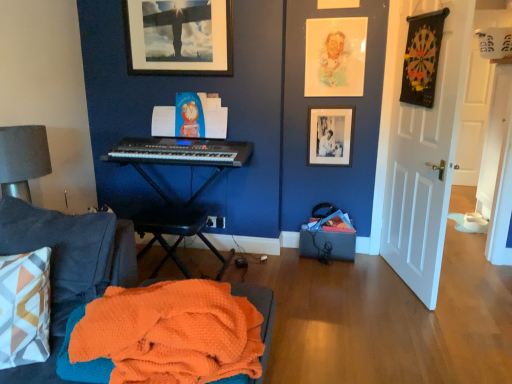
Locate an element on the screen. Image resolution: width=512 pixels, height=384 pixels. free space to the left of black fabric box at lower right is located at coordinates (285, 264).